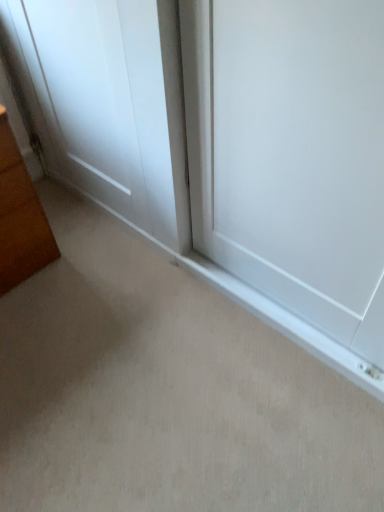
In order to face orange fabric drawer at left, should I rotate leftwards or rightwards?

Rotate your view left by about 22.636°.

Locate an element on the screen. Image resolution: width=384 pixels, height=512 pixels. orange fabric drawer at left is located at coordinates (15, 188).

This screenshot has height=512, width=384. What do you see at coordinates (15, 188) in the screenshot?
I see `orange fabric drawer at left` at bounding box center [15, 188].

Measure the distance between point (2, 202) and camera.

The distance of point (2, 202) from camera is 1.39 meters.

Identify the location of orange fabric drawer at left. (15, 188).